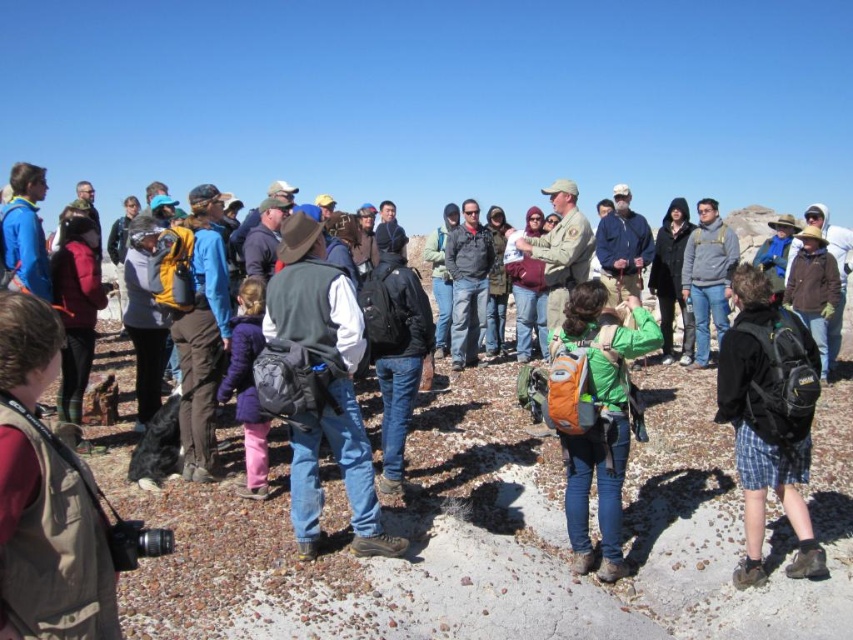
The image size is (853, 640). Find the location of `matte black backpack at center`. matte black backpack at center is located at coordinates (351, 480).

Is point (373, 456) closer to viewer compared to point (775, 412)?

No, (373, 456) is further to viewer.

Locate an element on the screen. matte black backpack at center is located at coordinates (351, 480).

Can you confirm if denim jacket at center is shorter than green fabric backpack at center?

Incorrect, denim jacket at center's height does not fall short of green fabric backpack at center's.

Who is more forward, [343,288] or [605,406]?

Point [605,406]

This screenshot has height=640, width=853. Describe the element at coordinates (318, 387) in the screenshot. I see `denim jacket at center` at that location.

Find the location of a particular element. The image size is (853, 640). denim jacket at center is located at coordinates (318, 387).

The width and height of the screenshot is (853, 640). What do you see at coordinates (44, 497) in the screenshot?
I see `brown suede vest at lower left` at bounding box center [44, 497].

In the scene shown: Does brown suede vest at lower left have a larger size compared to green fabric backpack at center?

Incorrect, brown suede vest at lower left is not larger than green fabric backpack at center.

Is point (3, 506) positioned before point (573, 556)?

Yes, point (3, 506) is in front of point (573, 556).

Find the location of a particular element. This screenshot has width=853, height=640. brown suede vest at lower left is located at coordinates (44, 497).